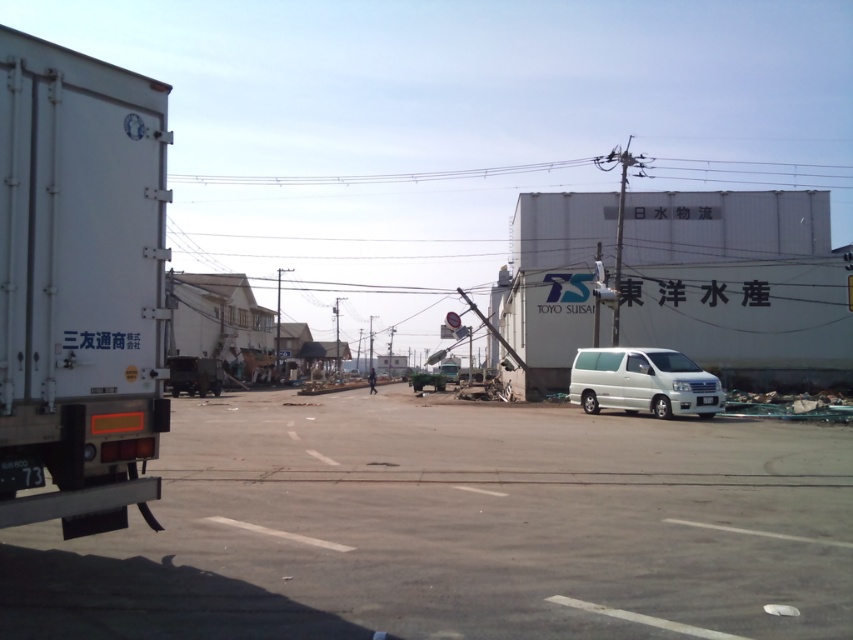
Looking at this image, can you confirm if gray asphalt parking lot at center is positioned above white metallic van at center?

No.

Between gray asphalt parking lot at center and white metallic van at center, which one has less height?

gray asphalt parking lot at center is shorter.

Where is `gray asphalt parking lot at center`? The width and height of the screenshot is (853, 640). gray asphalt parking lot at center is located at coordinates (454, 525).

You are a GUI agent. You are given a task and a screenshot of the screen. Output one action in this format:
    pyautogui.click(x=<x>, y=<y>)
    Task: Click on the gray asphalt parking lot at center
    Image resolution: width=853 pixels, height=640 pixels.
    Given the screenshot: What is the action you would take?
    click(x=454, y=525)

Between gray asphalt parking lot at center and white matte truck at left, which one has more height?

Standing taller between the two is gray asphalt parking lot at center.

Does gray asphalt parking lot at center have a greater width compared to white matte truck at left?

Yes, gray asphalt parking lot at center is wider than white matte truck at left.

Is point (738, 564) closer to viewer compared to point (112, 481)?

No, it is not.

Locate an element on the screen. The height and width of the screenshot is (640, 853). gray asphalt parking lot at center is located at coordinates (454, 525).

Does white matte truck at left lie in front of white metallic van at center?

Yes.

Is white matte truck at left positioned behind white metallic van at center?

No, it is in front of white metallic van at center.

Who is more distant from viewer, (125, 310) or (618, 371)?

The point (618, 371) is more distant.

Image resolution: width=853 pixels, height=640 pixels. In order to click on white matte truck at left in this screenshot , I will do `click(79, 284)`.